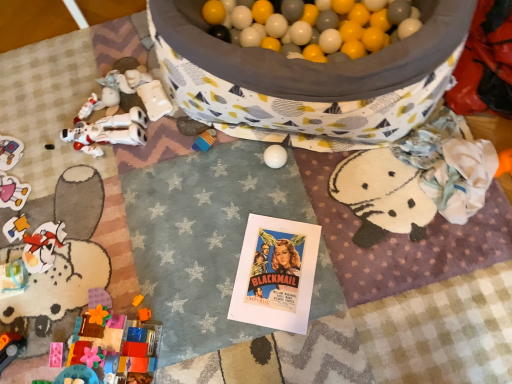
Locate an element on the screen. Image resolution: width=512 pixels, height=384 pixels. free point behind brick-like plastic blocks at lower left, arranged as the first toy when viewed from the front is located at coordinates (121, 279).